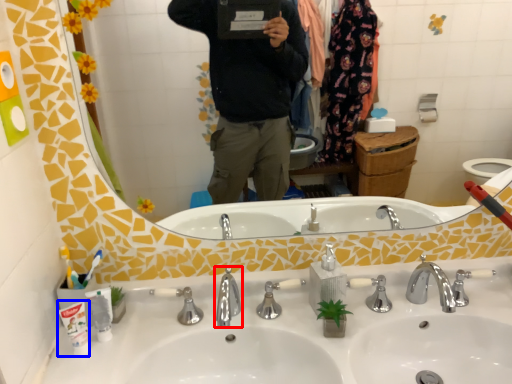
Question: Which point is further to the camera, tap (highlighted by a red box) or toothpaste (highlighted by a blue box)?

Choices:
 (A) tap
 (B) toothpaste

Answer: (B)